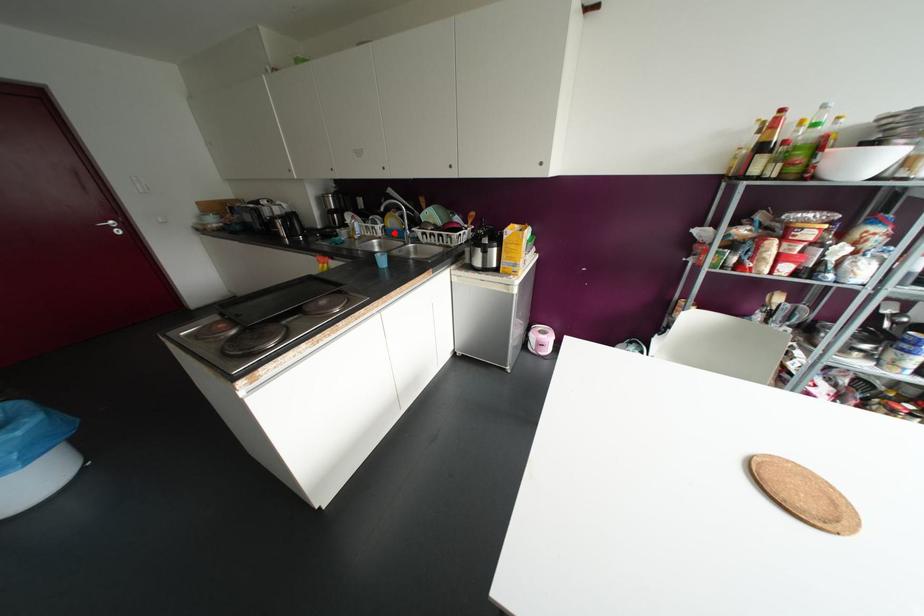
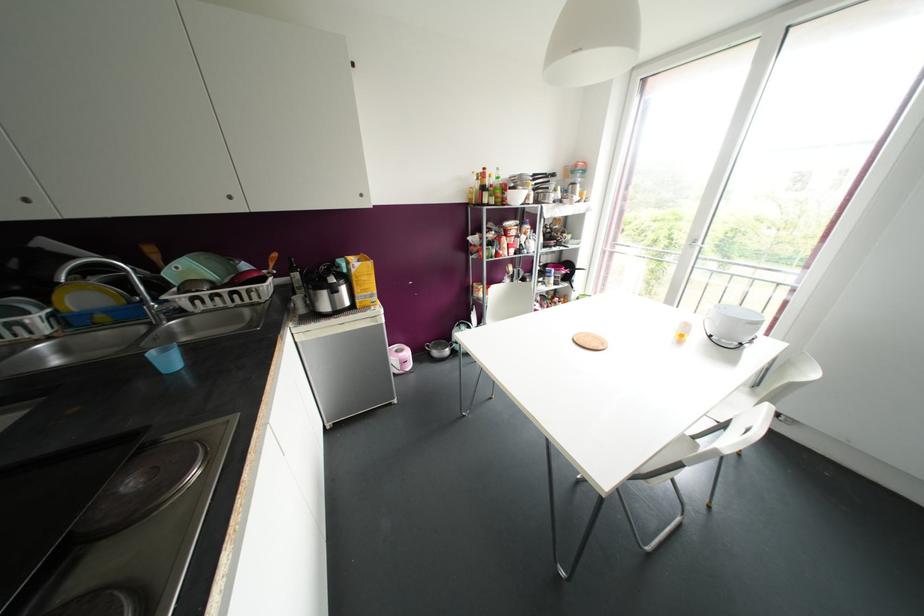
Question: I am providing you with two images of the same scene from different viewpoints. In image1, a red point is highlighted. Considering the same 3D point in image2, which of the following is correct?

Choices:
 (A) It is closer
 (B) It is farther

Answer: (B)